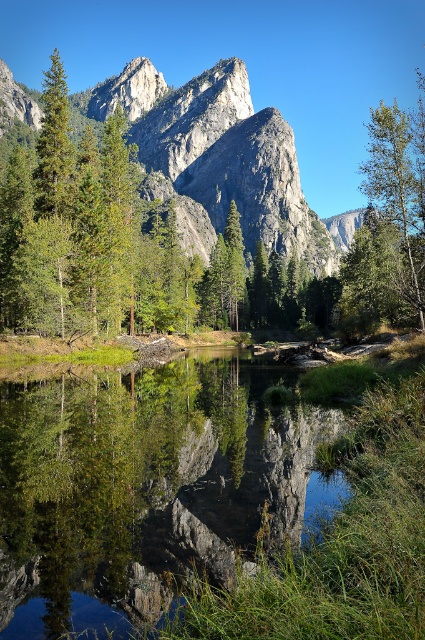
Is point (265, 113) in front of point (424, 104)?

That is True.

Between rugged granite mountain at center and green matte tree at right, which one has more height?

With more height is green matte tree at right.

What do you see at coordinates (218, 157) in the screenshot? I see `rugged granite mountain at center` at bounding box center [218, 157].

In order to click on rugged granite mountain at center in this screenshot , I will do `click(218, 157)`.

Consider the image. Is the position of green matte tree at right less distant than that of green matte tree at left?

Yes, green matte tree at right is closer to the viewer.

Who is more distant from viewer, (x=422, y=275) or (x=67, y=150)?

The point (x=67, y=150) is behind.

Where is `green matte tree at right`? green matte tree at right is located at coordinates point(399,195).

Who is taller, rugged granite mountain at center or green matte tree at left?

rugged granite mountain at center

Is rugged granite mountain at center wider than green matte tree at left?

Yes, rugged granite mountain at center is wider than green matte tree at left.

Is point (184, 141) farther from viewer compared to point (57, 115)?

Yes, point (184, 141) is behind point (57, 115).

Locate an element on the screen. This screenshot has height=640, width=425. rugged granite mountain at center is located at coordinates (218, 157).